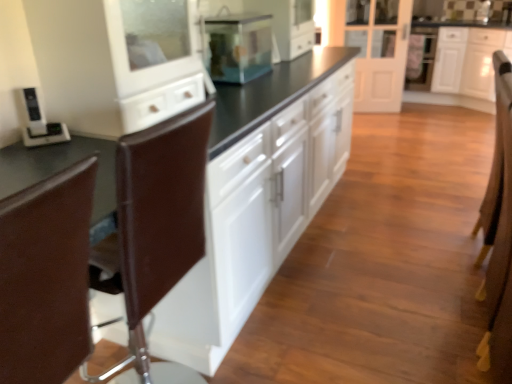
Find the location of a particular element. Image resolution: width=512 pixels, height=384 pixels. free area in between white glossy cabinets at center, the 2th cabinetry from the back, and brown leather armchair at right is located at coordinates (373, 255).